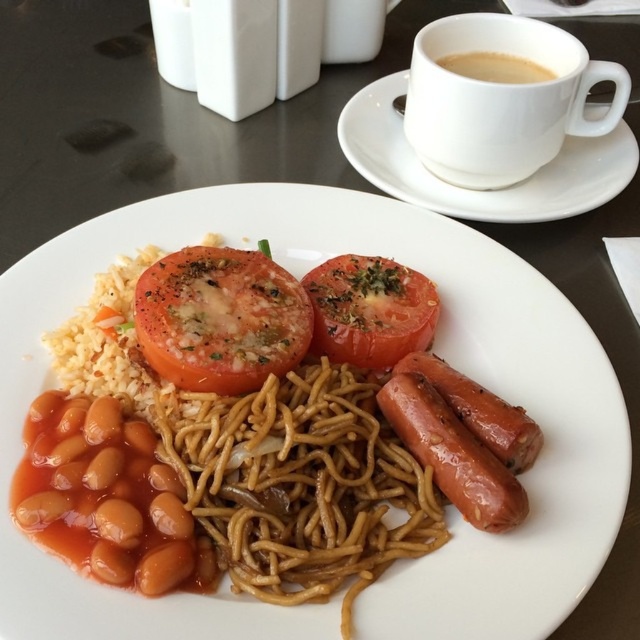
Question: Is slightly charred tomato at center below brown glossy beans at lower left?

Choices:
 (A) yes
 (B) no

Answer: (B)

Question: Which point is closer to the camera?

Choices:
 (A) (438, 61)
 (B) (301, 284)

Answer: (B)

Question: Which object appears farthest from the camera in this image?

Choices:
 (A) slightly charred tomato at center
 (B) brown glossy beans at lower left

Answer: (A)

Question: In this image, where is slightly charred tomato at center located relative to slightly charred glossy sausage at lower right?

Choices:
 (A) above
 (B) below

Answer: (A)

Question: Which object appears closest to the camera in this image?

Choices:
 (A) brown matte cup at upper right
 (B) slightly charred glossy sausage at lower right

Answer: (B)

Question: Does brown matte noodles at center have a lesser width compared to matte brown beans at lower left?

Choices:
 (A) yes
 (B) no

Answer: (B)